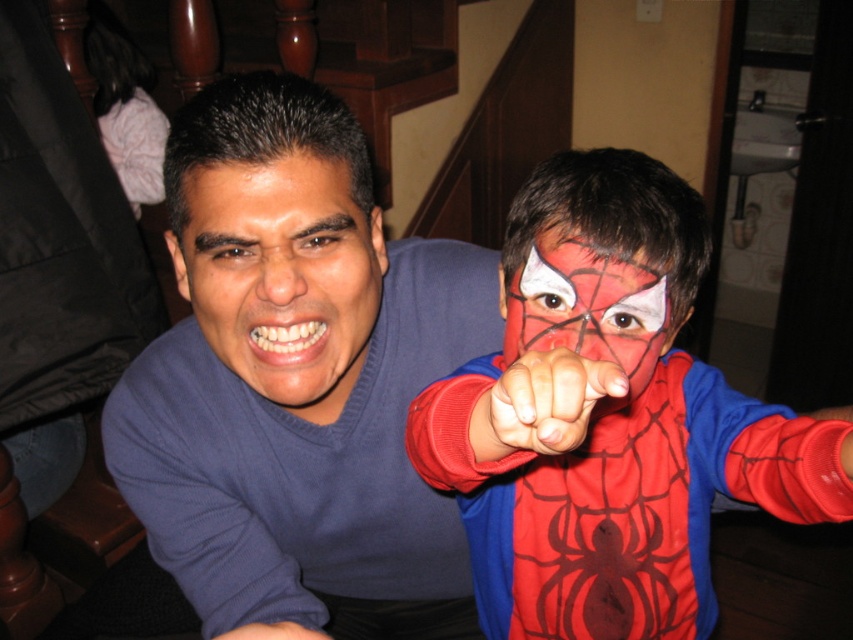
You are designing a shelf to display both the matte red costume at center and the matte blue shirt at center. If the shelf has a height limit of 1 meter, will both items fit?

The matte red costume at center is taller than the matte blue shirt at center. Since the shelf has a height limit of 1 meter, both items will fit as long as the tallest item, the matte red costume at center, is under 1 meter in height.

You are a photographer trying to capture a clear photo of the matte red face paint at center and the matte blue shirt at center. Since the camera can only focus on one subject at a time, which object should you choose to focus on to ensure the other is still somewhat in focus?

The matte red face paint at center is behind the matte blue shirt at center. If you focus on the matte blue shirt at center, the matte red face paint at center will be further away and may be less in focus. However, focusing on the matte red face paint at center would place the matte blue shirt at center closer to the focal plane, resulting in both being more in focus. Therefore, focus on the matte red face paint at center to ensure the matte blue shirt at center remains somewhat in focus.